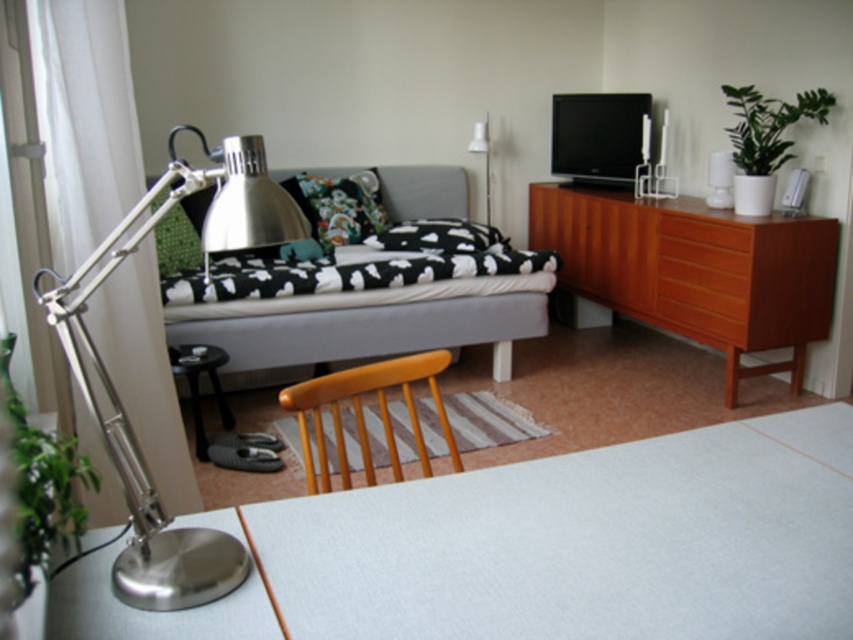
Where is the wooden chair at center located in the image?

The wooden chair at center is located at point (363, 413).